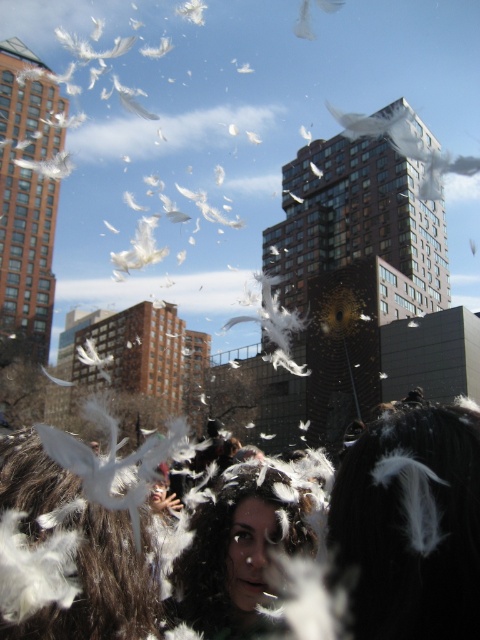
You are a photographer trying to capture the dark brown hair at center and the white feathered bird at center in a single frame. Which object will appear smaller in your photo?

The dark brown hair at center will appear smaller in the photo because it occupies less space than the white feathered bird at center.

You are a photographer capturing the lively urban scene. You notice two objects in the center of the image, the white feathered hair at center and the white feathered bird at center. Which one is located to the right of the other?

The white feathered hair at center is positioned on the right side of white feathered bird at center, so the white feathered hair at center is to the right of the white feathered bird at center.